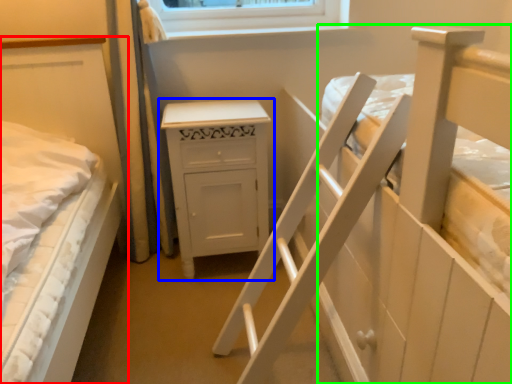
Question: Which object is positioned closest to bed (highlighted by a red box)? Select from chest of drawers (highlighted by a blue box) and bed (highlighted by a green box).

Choices:
 (A) chest of drawers
 (B) bed

Answer: (A)